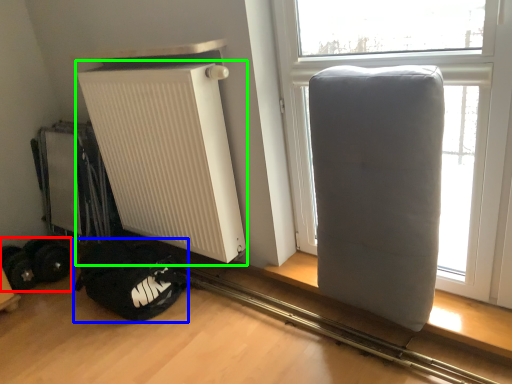
Question: Which object is positioned farthest from wheel (highlighted by a red box)? Select from sleeping bag (highlighted by a blue box) and radiator (highlighted by a green box).

Choices:
 (A) sleeping bag
 (B) radiator

Answer: (B)